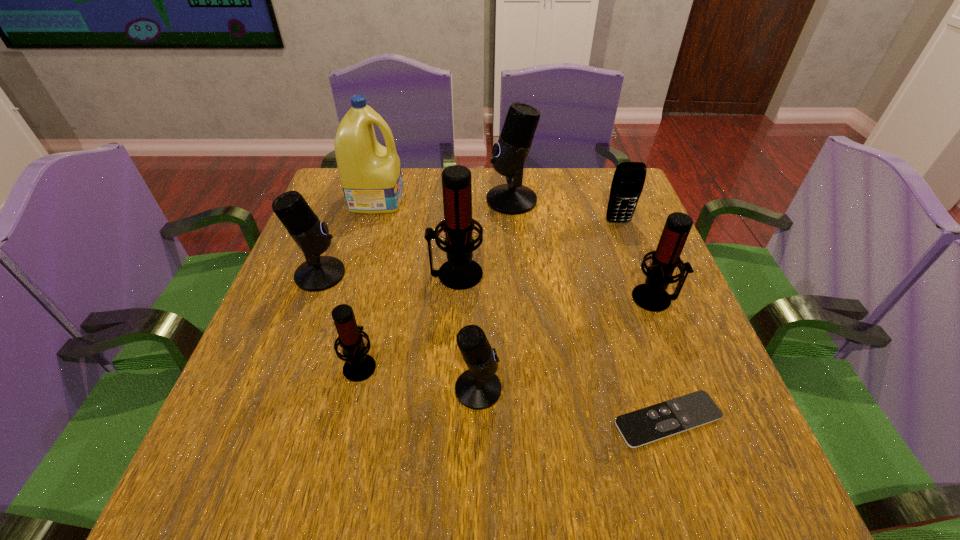
The width and height of the screenshot is (960, 540). Find the location of `object that is the fifth closest to the biggest black microphone`. object that is the fifth closest to the biggest black microphone is located at coordinates (318, 273).

Where is `object that is the seventh nearest to the smallest red microphone`? This screenshot has width=960, height=540. object that is the seventh nearest to the smallest red microphone is located at coordinates (651, 296).

At what (x,y) coordinates should I click in order to perform the action: click on the closest microphone to the shortest object. Please return your answer as a coordinate pair (x, y). Image resolution: width=960 pixels, height=540 pixels. Looking at the image, I should click on (478, 388).

What are the coordinates of `microphone that can be found as the fourth closest to the biggest black microphone` in the screenshot? It's located at (478, 388).

At what (x,y) coordinates should I click in order to perform the action: click on black microphone that is the closest to the second red microphone from right to left. Please return your answer as a coordinate pair (x, y). The image size is (960, 540). Looking at the image, I should click on (510, 153).

Identify the location of black microphone that is the closest one to the second red microphone from left to right. (510, 153).

Identify which red microphone is the third closest to the smallest black microphone. Please provide its 2D coordinates. Your answer should be formatted as a tuple, i.e. [(x, y)], where the tuple contains the x and y coordinates of a point satisfying the conditions above.

[(651, 296)]

What are the coordinates of `red microphone identified as the closest to the biggest red microphone` in the screenshot? It's located at (359, 366).

The height and width of the screenshot is (540, 960). I want to click on vacant space that satisfies the following two spatial constraints: 1. on the label of the biggest red microphone; 2. on the right side of the detergent, so click(x=355, y=274).

Find the location of `vacant space that satisfies the following two spatial constraints: 1. on the front side of the biggest red microphone; 2. on the stand of the leftmost microphone`. vacant space that satisfies the following two spatial constraints: 1. on the front side of the biggest red microphone; 2. on the stand of the leftmost microphone is located at coordinates (456, 274).